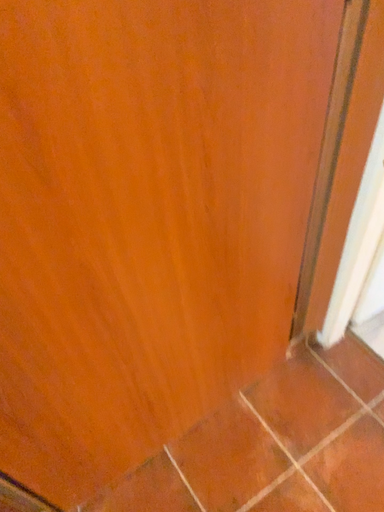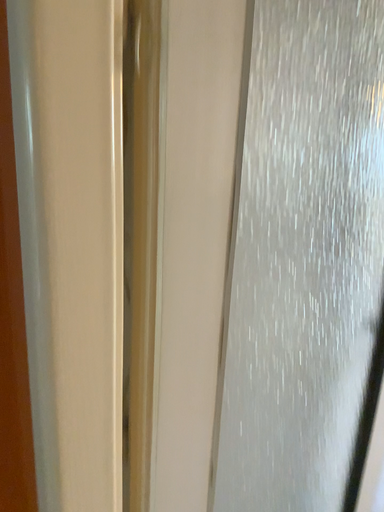
Question: How did the camera likely rotate when shooting the video?

Choices:
 (A) rotated downward
 (B) rotated upward

Answer: (B)